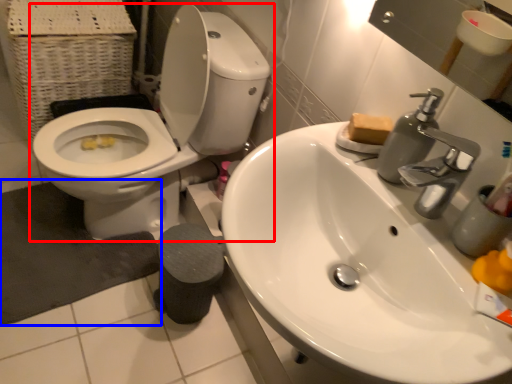
Question: Which point is closer to the camera, toilet (highlighted by a red box) or bath mat (highlighted by a blue box)?

Choices:
 (A) toilet
 (B) bath mat

Answer: (A)